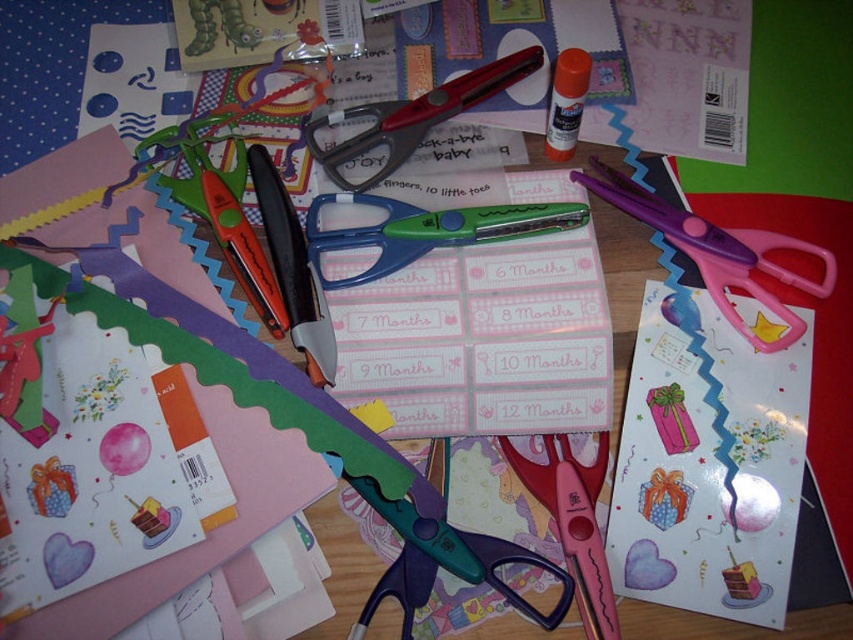
Between blue plastic scissors at center and green plastic scissors at center, which one is positioned higher?

blue plastic scissors at center is above.

Which is behind, point (444, 225) or point (497, 588)?

The point (444, 225) is behind.

Where is `blue plastic scissors at center`? The height and width of the screenshot is (640, 853). blue plastic scissors at center is located at coordinates (427, 230).

Can you confirm if green plastic scissors at center is smaller than metallic red scissors at center?

Correct, green plastic scissors at center occupies less space than metallic red scissors at center.

Between green plastic scissors at center and metallic red scissors at center, which one has less height?

With less height is green plastic scissors at center.

Describe the element at coordinates (445, 561) in the screenshot. I see `green plastic scissors at center` at that location.

The image size is (853, 640). I want to click on green plastic scissors at center, so click(x=445, y=561).

Is pink plastic scissors at upper right behind metallic red scissors at center?

No, pink plastic scissors at upper right is closer to the viewer.

Is pink plastic scissors at upper right smaller than metallic red scissors at center?

No.

Describe the element at coordinates (718, 252) in the screenshot. This screenshot has height=640, width=853. I see `pink plastic scissors at upper right` at that location.

At what (x,y) coordinates should I click in order to perform the action: click on pink plastic scissors at upper right. Please return your answer as a coordinate pair (x, y). Image resolution: width=853 pixels, height=640 pixels. Looking at the image, I should click on (718, 252).